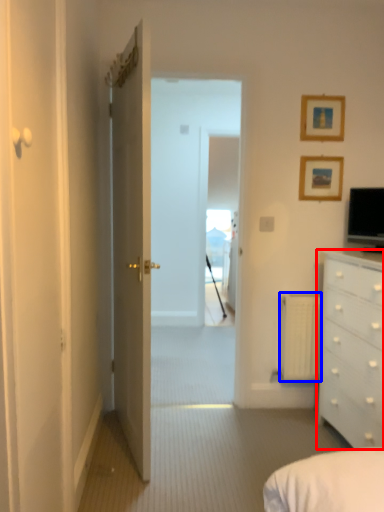
Question: Which object appears farthest to the camera in this image, chest of drawers (highlighted by a red box) or radiator (highlighted by a blue box)?

Choices:
 (A) chest of drawers
 (B) radiator

Answer: (B)